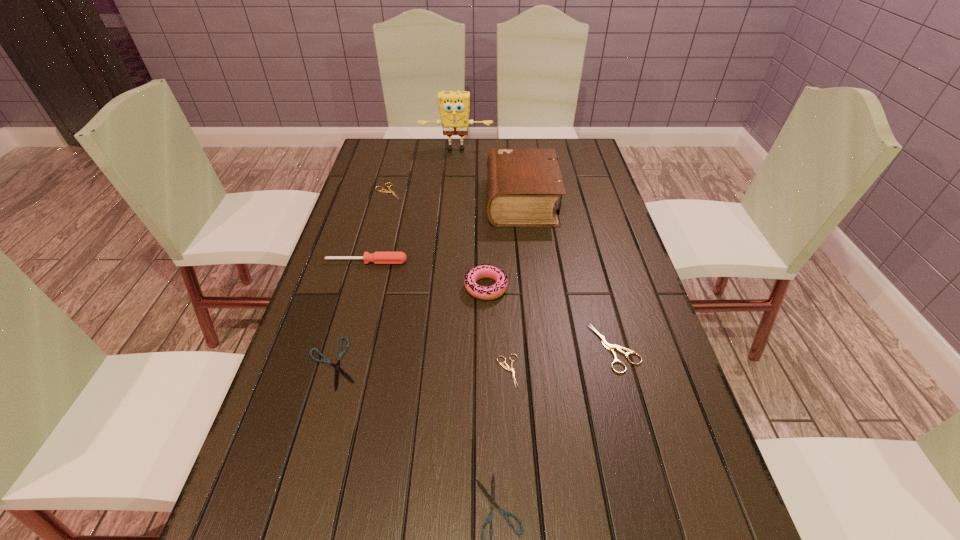
Locate an element on the screen. shears that stands as the third closest to the smallest beige shears is located at coordinates (337, 366).

You are a GUI agent. You are given a task and a screenshot of the screen. Output one action in this format:
    pyautogui.click(x=<x>, y=<y>)
    Task: Click on the beige shears that can be found as the second closest to the red screwdriver
    The width and height of the screenshot is (960, 540).
    Given the screenshot: What is the action you would take?
    pyautogui.click(x=506, y=367)

Select which beige shears appears as the second closest to the doughnut. Please provide its 2D coordinates. Your answer should be formatted as a tuple, i.e. [(x, y)], where the tuple contains the x and y coordinates of a point satisfying the conditions above.

[(608, 346)]

Locate an element on the screen. black shears that is the second nearest to the second tallest object is located at coordinates (491, 498).

I want to click on black shears that is the closest to the tallest object, so click(x=337, y=366).

Find the location of a particular element. This screenshot has height=540, width=960. vacant space that satisfies the following two spatial constraints: 1. on the face of the tallest object; 2. on the right side of the rightmost beige shears is located at coordinates (440, 348).

The image size is (960, 540). Find the location of `free location that satisfies the following two spatial constraints: 1. on the face of the tallest object; 2. on the left side of the second beige shears from left to right`. free location that satisfies the following two spatial constraints: 1. on the face of the tallest object; 2. on the left side of the second beige shears from left to right is located at coordinates (438, 371).

Where is `vacant region that satisfies the following two spatial constraints: 1. on the back side of the screwdriver; 2. on the left side of the leftmost beige shears`? The width and height of the screenshot is (960, 540). vacant region that satisfies the following two spatial constraints: 1. on the back side of the screwdriver; 2. on the left side of the leftmost beige shears is located at coordinates (386, 192).